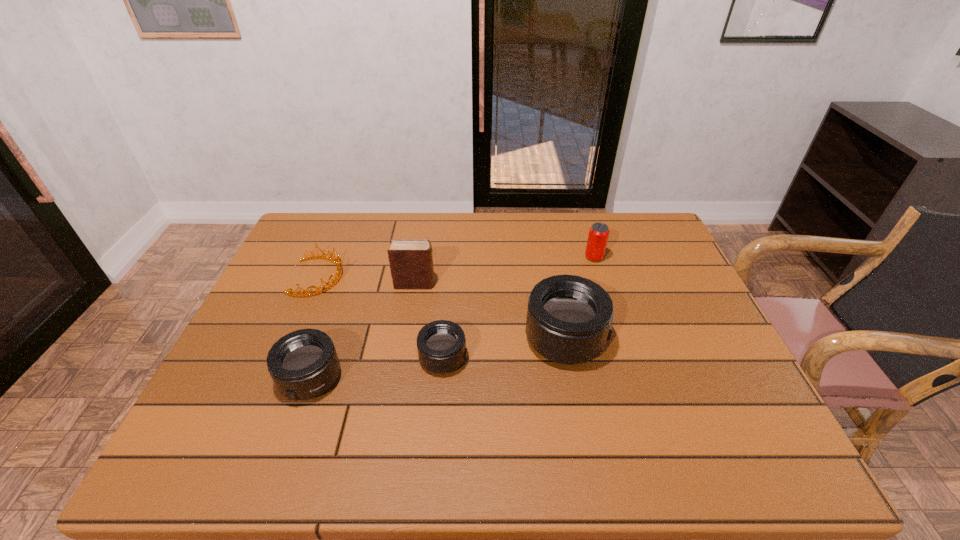
This screenshot has height=540, width=960. In the image, there is a desktop. Find the location of `free space at the near edge`. free space at the near edge is located at coordinates (633, 405).

At what (x,y) coordinates should I click in order to perform the action: click on free space at the left edge of the desktop. Please return your answer as a coordinate pair (x, y). Looking at the image, I should click on click(x=264, y=305).

Identify the location of vacant space at the right edge. (663, 289).

Where is `vacant space at the far left corner of the desktop`? vacant space at the far left corner of the desktop is located at coordinates (333, 238).

The width and height of the screenshot is (960, 540). Find the location of `vacant region at the near left corner of the desktop`. vacant region at the near left corner of the desktop is located at coordinates (267, 414).

The width and height of the screenshot is (960, 540). I want to click on vacant area at the far right corner, so click(x=661, y=241).

Where is `vacant space that is in between the fourth tallest object and the tiara`? The height and width of the screenshot is (540, 960). vacant space that is in between the fourth tallest object and the tiara is located at coordinates pyautogui.click(x=314, y=328).

This screenshot has width=960, height=540. Find the location of `empty space that is in between the second tallest telephoto lens and the tiara`. empty space that is in between the second tallest telephoto lens and the tiara is located at coordinates (314, 328).

You are a GUI agent. You are given a task and a screenshot of the screen. Output one action in this format:
    pyautogui.click(x=<x>, y=<y>)
    Task: Click on the empty space that is in between the second telephoto lens from right to left and the third shortest object
    The width and height of the screenshot is (960, 540).
    Given the screenshot: What is the action you would take?
    pyautogui.click(x=376, y=368)

Where is `unoccupied area between the tiara and the diary`? Image resolution: width=960 pixels, height=540 pixels. unoccupied area between the tiara and the diary is located at coordinates (367, 280).